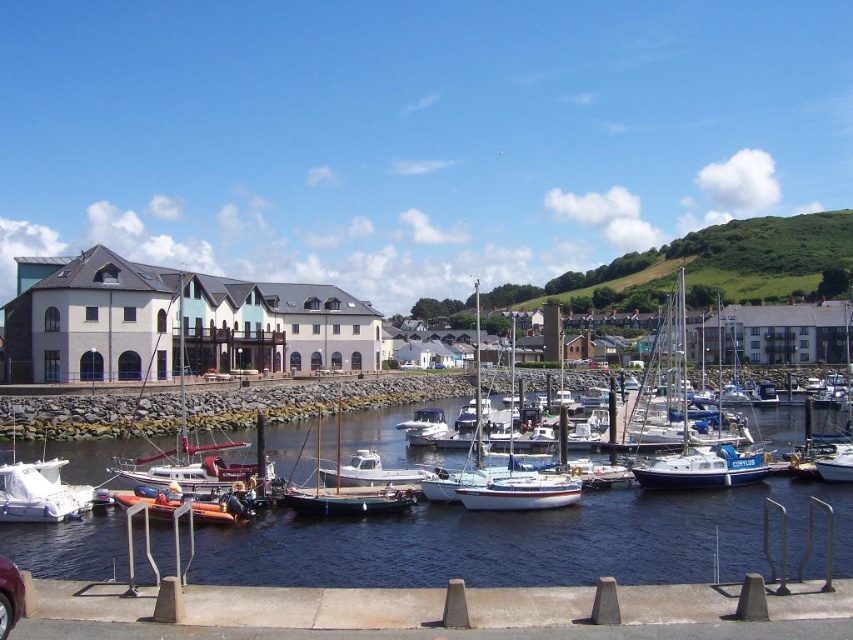
Question: Which object appears closest to the camera in this image?

Choices:
 (A) clear water at center
 (B) wooden sailboat at center
 (C) white matte sailboat at center

Answer: (A)

Question: Is clear water at center below orange rubber dinghy at lower left?

Choices:
 (A) yes
 (B) no

Answer: (A)

Question: Which object is farther from the camera taking this photo?

Choices:
 (A) blue matte sailboat at center
 (B) wooden sailboat at center
 (C) metallic red car at lower left
 (D) white matte sailboat at center

Answer: (A)

Question: In this image, where is smooth concrete dock at lower center located relative to wooden sailboat at center?

Choices:
 (A) below
 (B) above

Answer: (A)

Question: From the image, what is the correct spatial relationship of smooth concrete dock at lower center in relation to orange rubber dinghy at lower left?

Choices:
 (A) left
 (B) right

Answer: (B)

Question: Which object is farther from the camera taking this photo?

Choices:
 (A) orange rubber dinghy at lower left
 (B) white matte sailboat at center

Answer: (B)